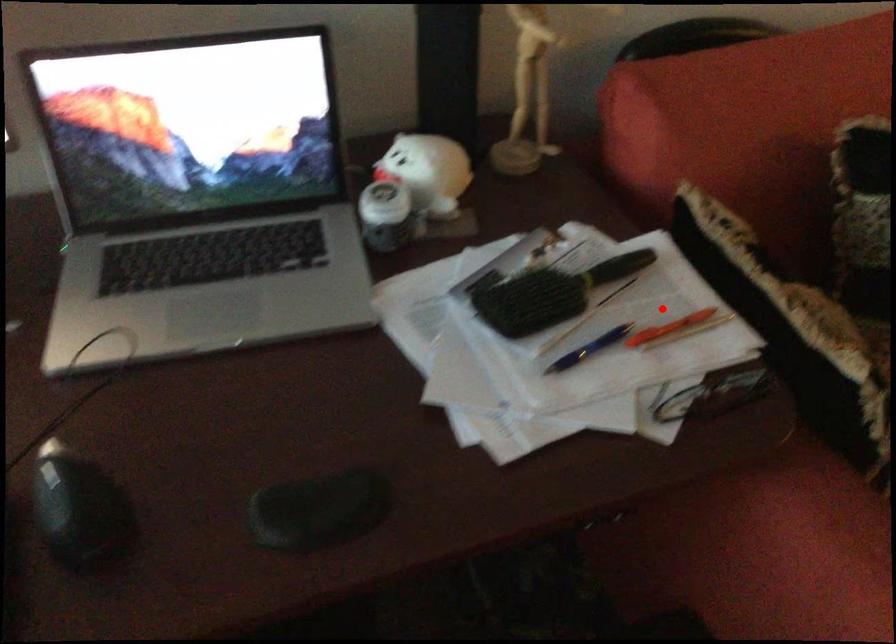
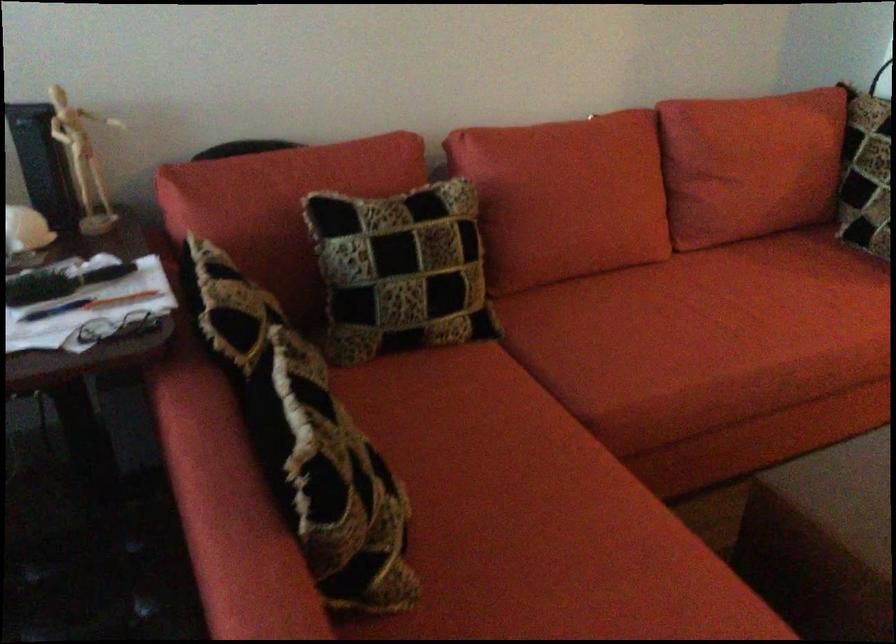
The point at the highlighted location is marked in the first image. Where is the corresponding point in the second image?

(122, 299)